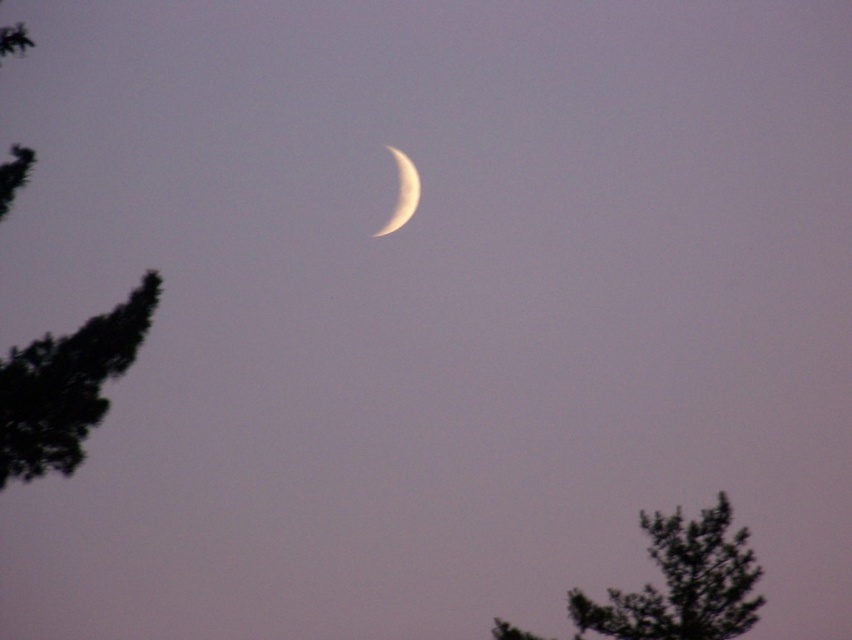
Looking at this image, you are a photographer standing at the center of the scene. You want to take a photo of the crescent moon and the green textured tree at lower right. Based on their positions, which object is closer to the center of the scene?

The crescent moon is positioned centrally, while the green textured tree at lower right is at point (x=681, y=582). Since the moon is centrally located, it is closer to the center of the scene than the green textured tree at lower right.